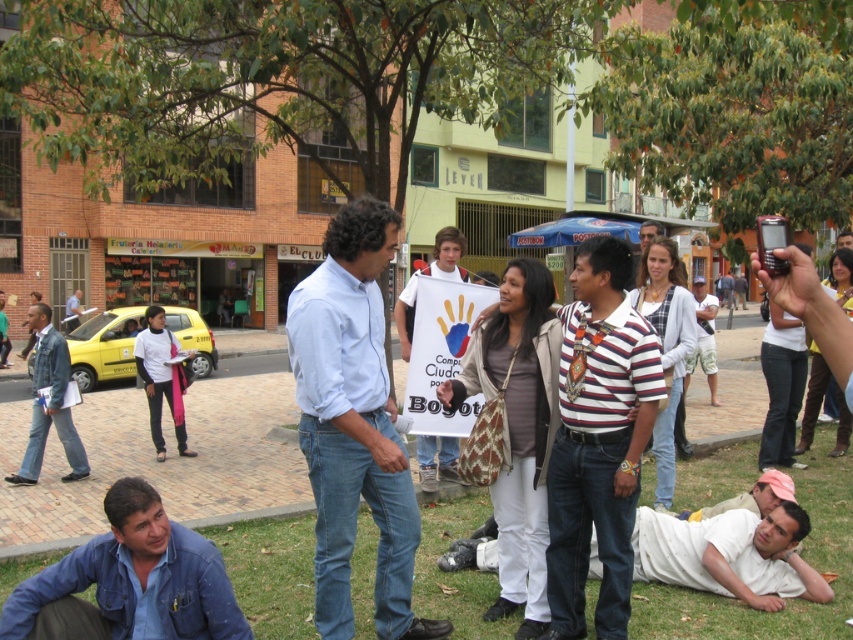
You are a photographer standing in the public square and want to capture a photo that includes both the green grass at lower center and the white cotton shirt at lower right. Which object should you focus on first to ensure both are in frame?

The green grass at lower center is not as tall as the white cotton shirt at lower right, so you should focus on the white cotton shirt at lower right first to ensure both are in frame.

You are standing in the public square and notice two clothing items in the scene. The striped cotton shirt at center and the denim jacket at left. Which one is positioned to the right of the other?

The striped cotton shirt at center is positioned to the right of the denim jacket at left.